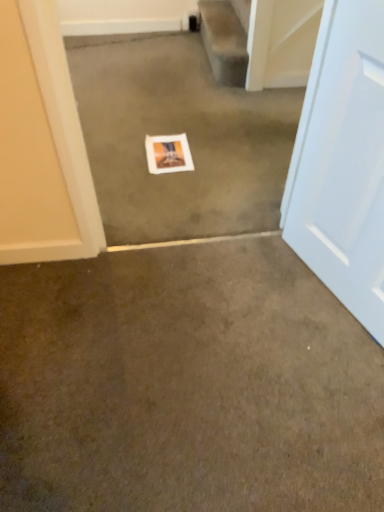
Question: Visually, is white paper at center, marked as the 2th concrete in a bottom-to-top arrangement, positioned to the left or to the right of white matte picture frame at center?

Choices:
 (A) left
 (B) right

Answer: (B)

Question: Looking at the image, does white paper at center, marked as the 2th concrete in a bottom-to-top arrangement, seem bigger or smaller compared to white matte picture frame at center?

Choices:
 (A) small
 (B) big

Answer: (B)

Question: Which object is positioned farthest from the brown carpet at center, which is counted as the first concrete, starting from the bottom?

Choices:
 (A) white paper at center, the 1th concrete when ordered from top to bottom
 (B) white matte picture frame at center
 (C) white glossy door at right
 (D) smooth beige carpet at upper center

Answer: (D)

Question: Which object is the closest to the white glossy door at right?

Choices:
 (A) white matte picture frame at center
 (B) smooth beige carpet at upper center
 (C) brown carpet at center, the second concrete viewed from the top
 (D) white paper at center, the 1th concrete when ordered from top to bottom

Answer: (C)